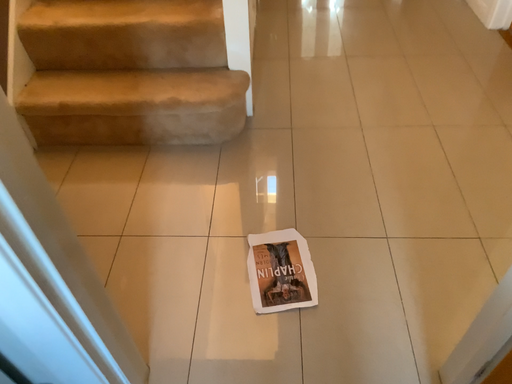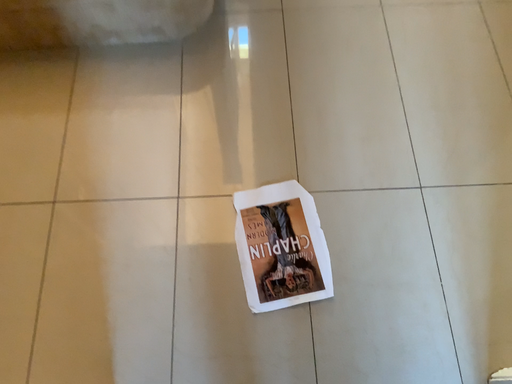
Question: Which way did the camera rotate in the video?

Choices:
 (A) rotated downward
 (B) rotated upward

Answer: (A)